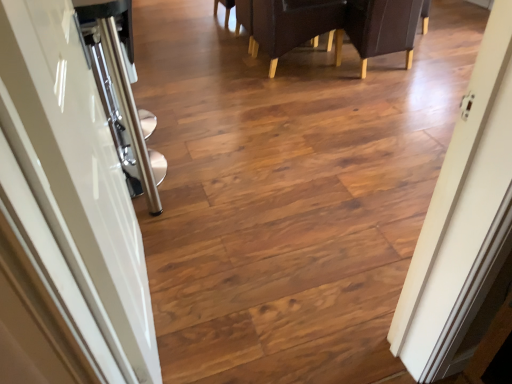
Find the location of a particular element. vacant space to the right of dark brown leather armchair at upper right, the second armchair from the left is located at coordinates (437, 62).